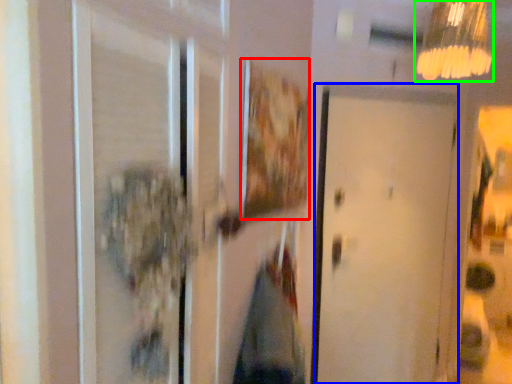
Question: Which object is the farthest from picture frame (highlighted by a red box)? Choose among these: door (highlighted by a blue box) or lamp (highlighted by a green box).

Choices:
 (A) door
 (B) lamp

Answer: (B)